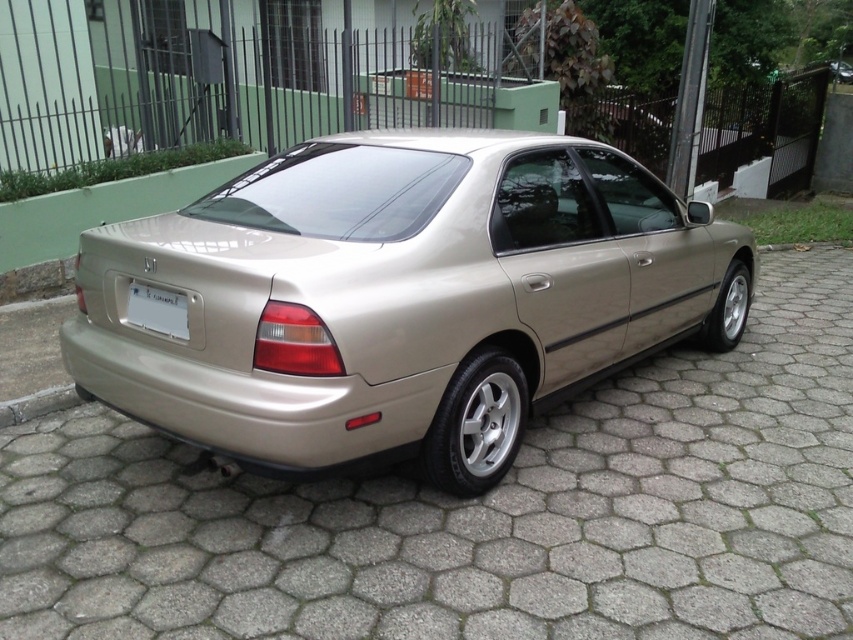
Is metallic gold car at center thinner than gray concrete curb at lower left?

No.

Who is taller, metallic gold car at center or gray concrete curb at lower left?

metallic gold car at center

This screenshot has height=640, width=853. I want to click on metallic gold car at center, so click(x=477, y=513).

Identify the location of metallic gold sedan at center. This screenshot has width=853, height=640. (399, 296).

Looking at this image, between metallic gold car at center and white plastic license plate at center, which one appears on the left side from the viewer's perspective?

white plastic license plate at center

Who is more forward, (793, 538) or (154, 301)?

Point (154, 301) is more forward.

Is point (746, 371) positioned behind point (178, 332)?

That is True.

You are a GUI agent. You are given a task and a screenshot of the screen. Output one action in this format:
    pyautogui.click(x=<x>, y=<y>)
    Task: Click on the metallic gold car at center
    
    Given the screenshot: What is the action you would take?
    pyautogui.click(x=477, y=513)